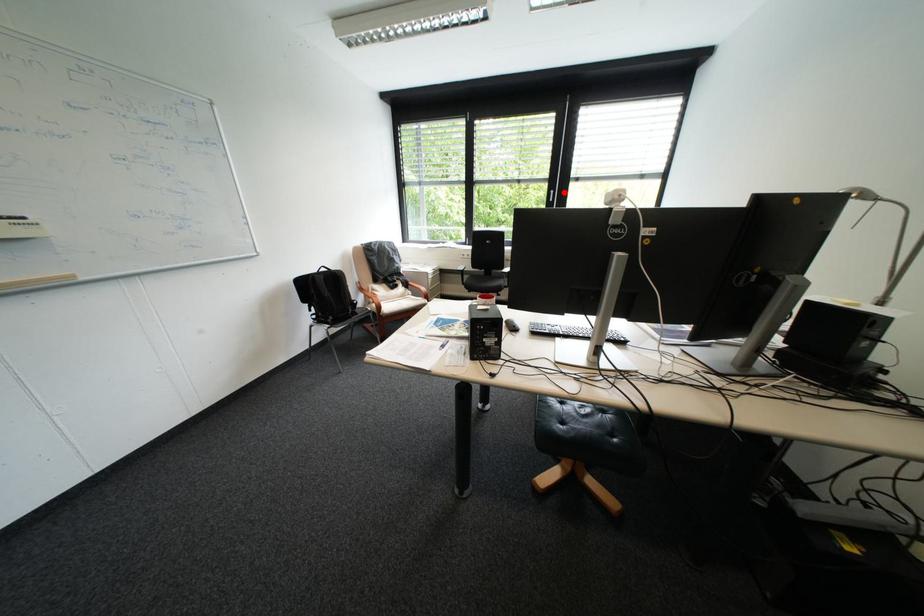
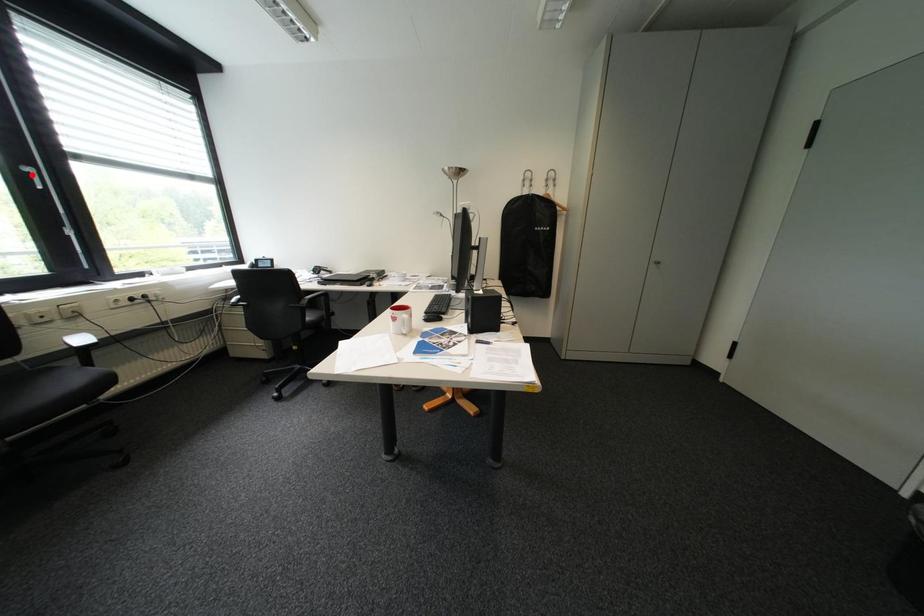
I am providing you with two images of the same scene from different viewpoints. A red point is marked on the first image and another point is marked on the second image. Is the marked point in image1 the same physical position as the marked point in image2?

No